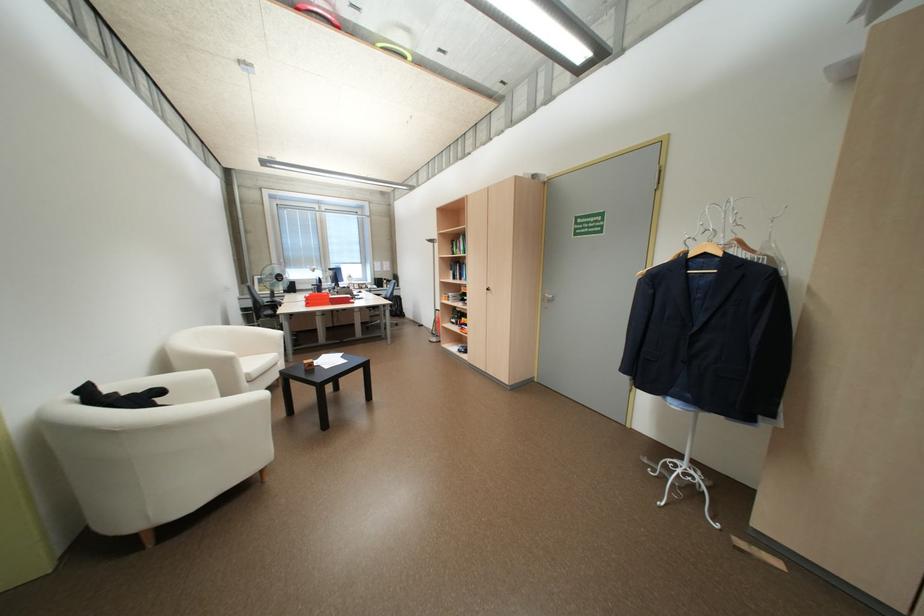
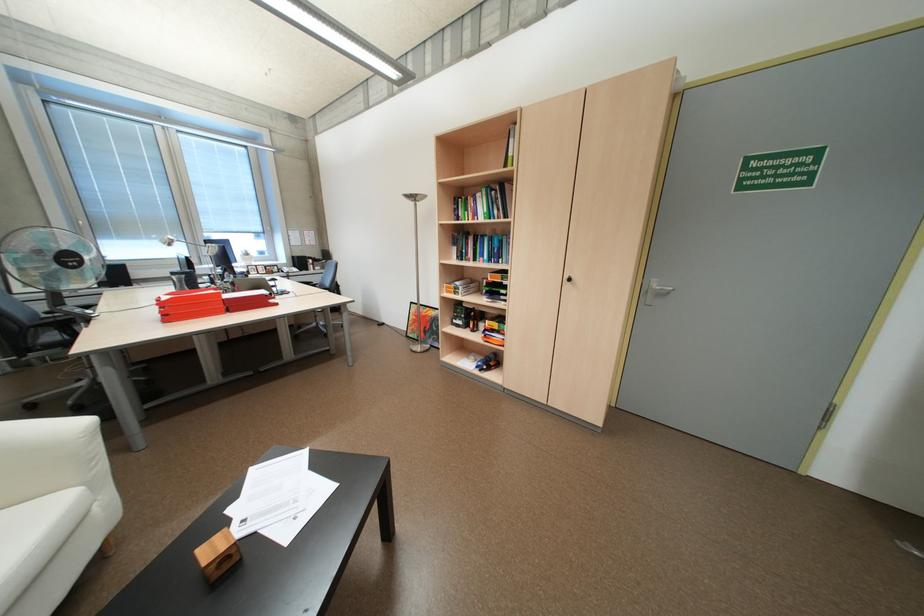
What movement of the cameraman would produce the second image?

The cameraman walked toward left, forward.